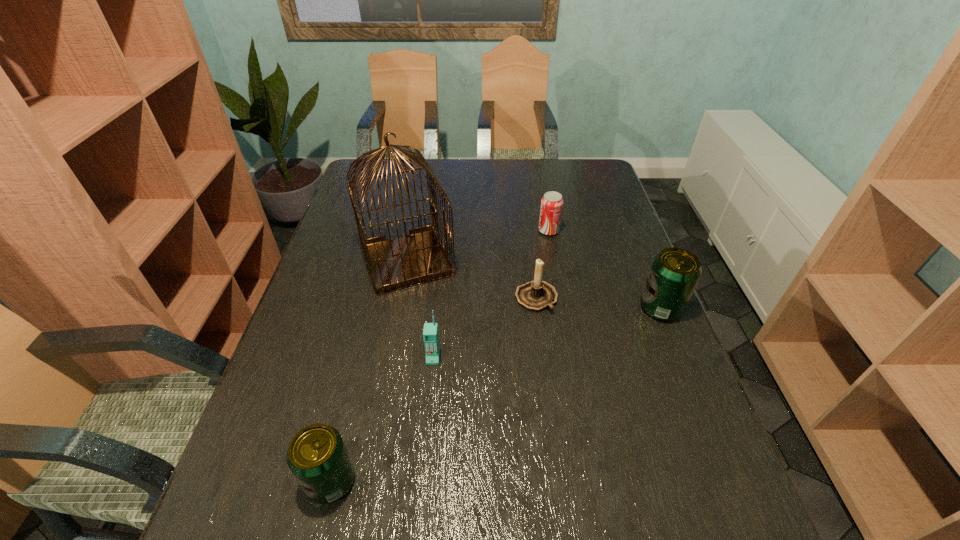
Find the location of `free point located on the right of the birdcage`. free point located on the right of the birdcage is located at coordinates (556, 260).

Where is `vacant position located on the logo side of the soda can`? The image size is (960, 540). vacant position located on the logo side of the soda can is located at coordinates (459, 231).

Locate an element on the screen. This screenshot has height=540, width=960. free spot located on the logo side of the soda can is located at coordinates (449, 231).

The width and height of the screenshot is (960, 540). In order to click on free space located 0.080m on the logo side of the soda can in this screenshot , I will do pos(513,231).

Locate an element on the screen. The height and width of the screenshot is (540, 960). vacant space positioned on the front of the candle holder is located at coordinates (544, 357).

Image resolution: width=960 pixels, height=540 pixels. I want to click on free space located 0.100m on the keypad of the cellular telephone, so click(429, 404).

Find the location of a particular element. The height and width of the screenshot is (540, 960). object positioned at the near edge is located at coordinates (317, 456).

This screenshot has width=960, height=540. I want to click on beer can located in the left edge section of the desktop, so click(317, 456).

I want to click on birdcage located in the left edge section of the desktop, so click(x=417, y=258).

Identify the location of object that is at the right edge. The height and width of the screenshot is (540, 960). 675,272.